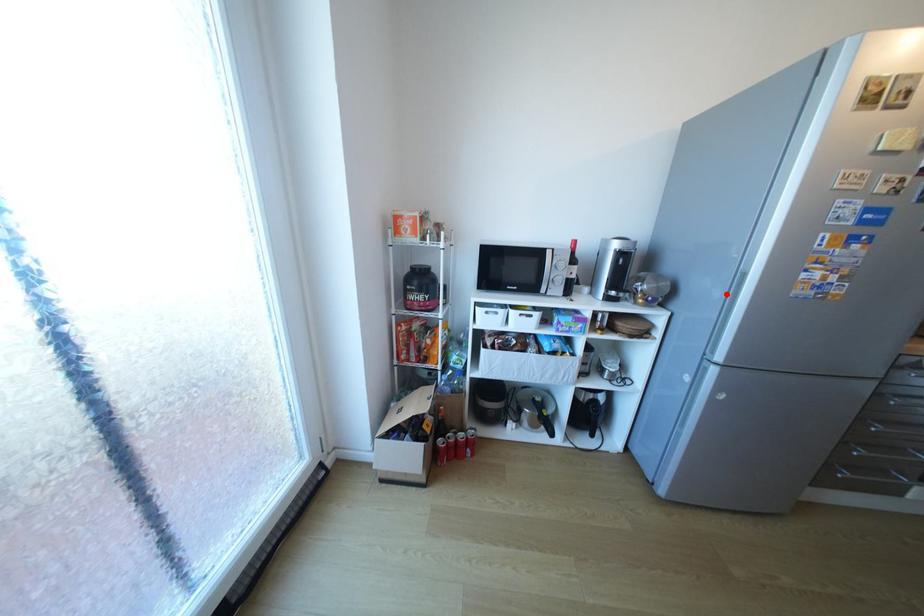
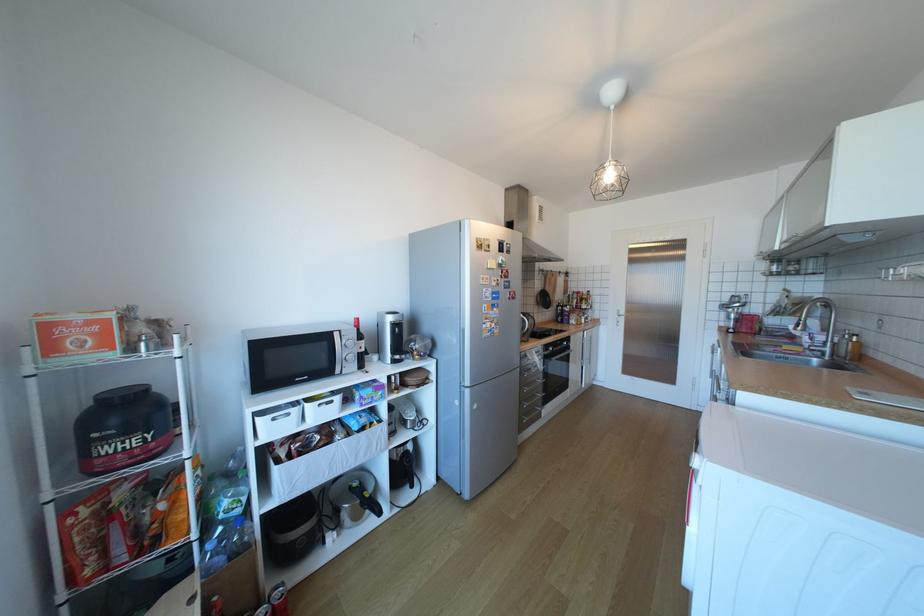
Question: I am providing you with two images of the same scene from different viewpoints. Given a red point in image1, look at the same physical point in image2. Is it:

Choices:
 (A) Closer to the viewpoint
 (B) Farther from the viewpoint

Answer: (B)